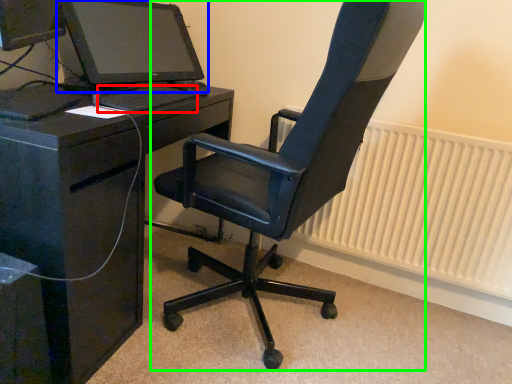
Question: Based on their relative distances, which object is nearer to computer keyboard (highlighted by a red box)? Choose from computer monitor (highlighted by a blue box) and chair (highlighted by a green box).

Choices:
 (A) computer monitor
 (B) chair

Answer: (A)